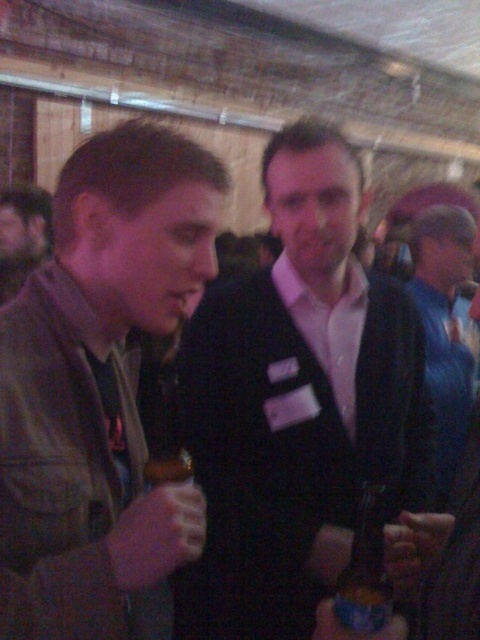
Question: Does blue leather jacket at right have a greater width compared to blue glass bottle at center?

Choices:
 (A) yes
 (B) no

Answer: (A)

Question: Which of the following is the farthest from the observer?

Choices:
 (A) (28, 256)
 (B) (365, 536)
 (C) (100, 472)
 (D) (453, 337)

Answer: (A)

Question: Which object is farther from the camera taking this photo?

Choices:
 (A) black matte suit at center
 (B) blue leather jacket at right
 (C) blue glass bottle at center
 (D) leather jacket at left

Answer: (B)

Question: Does black matte suit at center appear over blue glass bottle at center?

Choices:
 (A) yes
 (B) no

Answer: (A)

Question: Which point is closer to the camera?

Choices:
 (A) blue leather jacket at right
 (B) brown leather jacket at center

Answer: (A)

Question: Is the position of blue leather jacket at right less distant than that of brown leather jacket at center?

Choices:
 (A) yes
 (B) no

Answer: (A)